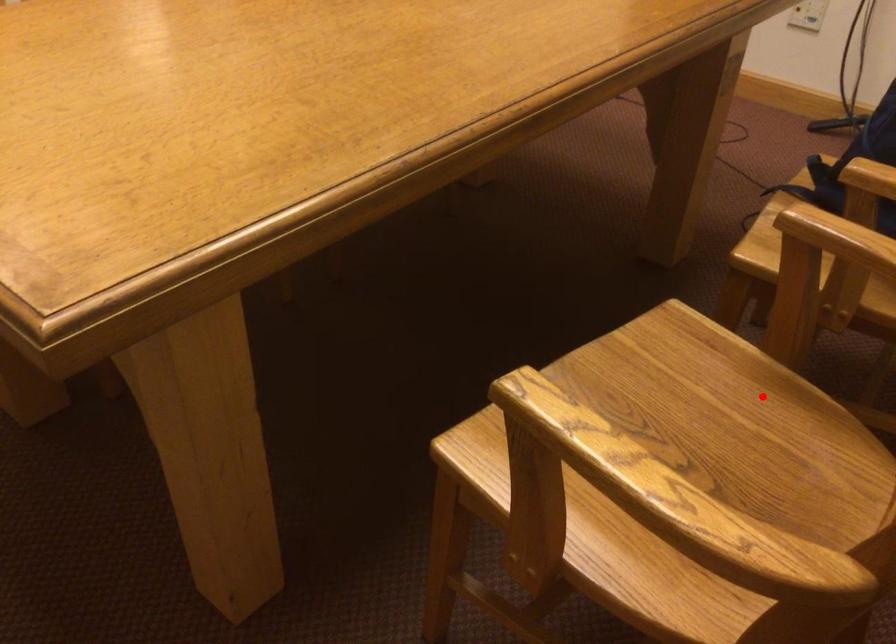
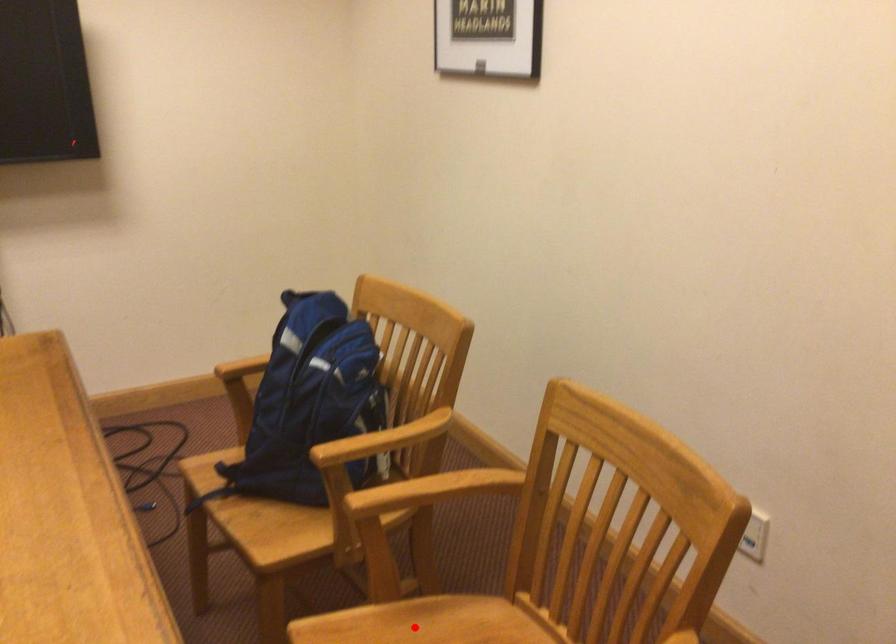
I am providing you with two images of the same scene from different viewpoints. A red point is marked on the first image and another point is marked on the second image. Does the point marked in image1 correspond to the same location as the one in image2?

Yes